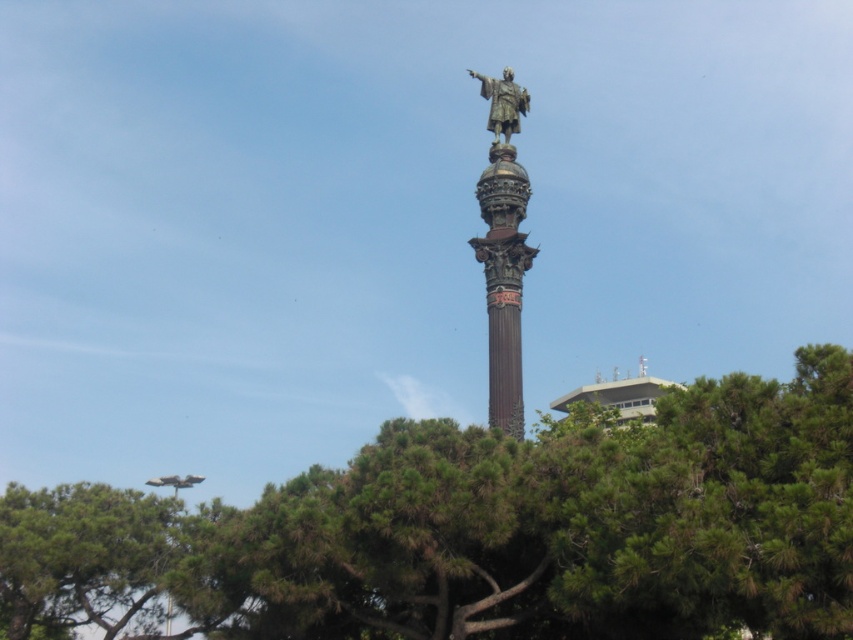
Does green textured tree at center appear on the left side of bronze statue at center?

Indeed, green textured tree at center is positioned on the left side of bronze statue at center.

Describe the element at coordinates (486, 531) in the screenshot. This screenshot has height=640, width=853. I see `green textured tree at center` at that location.

Where is `green textured tree at center`? green textured tree at center is located at coordinates (486, 531).

How distant is green textured tree at center from bronze statue at upper center?

The distance of green textured tree at center from bronze statue at upper center is 30.44 meters.

I want to click on green textured tree at center, so click(486, 531).

Identify the location of green textured tree at center. This screenshot has height=640, width=853. (486, 531).

Can you confirm if bronze statue at center is positioned to the right of bronze statue at upper center?

In fact, bronze statue at center is to the left of bronze statue at upper center.

Does bronze statue at center appear on the left side of bronze statue at upper center?

Correct, you'll find bronze statue at center to the left of bronze statue at upper center.

Which is behind, point (503, 227) or point (498, 104)?

Positioned behind is point (498, 104).

I want to click on bronze statue at center, so click(x=503, y=250).